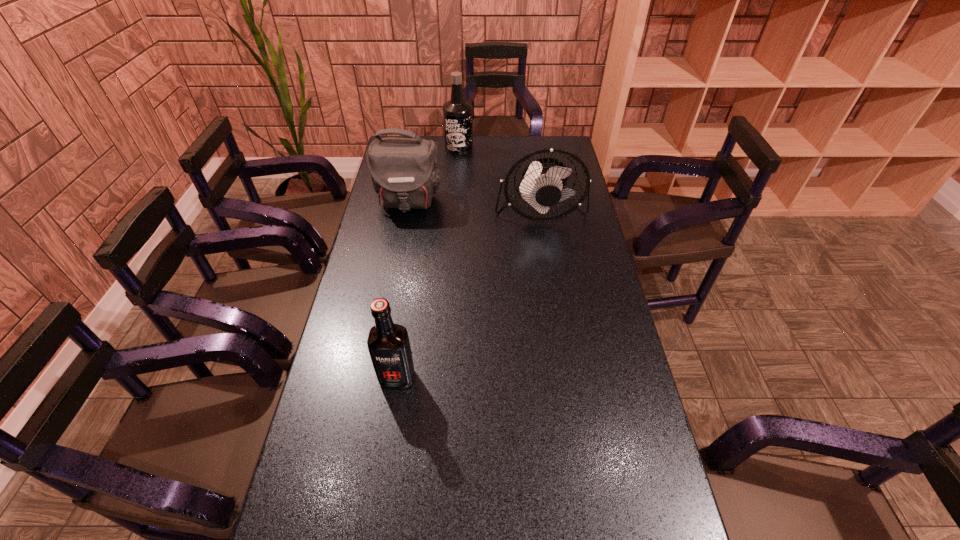
This screenshot has width=960, height=540. I want to click on the farther liquor, so click(x=457, y=113).

Image resolution: width=960 pixels, height=540 pixels. I want to click on the right liquor, so click(x=457, y=113).

Locate an element on the screen. fan is located at coordinates (542, 183).

You are a GUI agent. You are given a task and a screenshot of the screen. Output one action in this format:
    pyautogui.click(x=<x>, y=<y>)
    Task: Click on the nearer liquor
    
    Given the screenshot: What is the action you would take?
    pyautogui.click(x=388, y=344)

The image size is (960, 540). What are the coordinates of `the nearest object` in the screenshot? It's located at (388, 344).

Find the location of `shoulder bag`. shoulder bag is located at coordinates (404, 172).

Identify the location of vacant region located on the front label of the farthest object. Image resolution: width=960 pixels, height=540 pixels. (455, 203).

This screenshot has width=960, height=540. Find the location of `vacant space located 0.150m in front of the rightmost object, directing airflow`. vacant space located 0.150m in front of the rightmost object, directing airflow is located at coordinates (548, 262).

At what (x,y) coordinates should I click in order to perform the action: click on free spot located on the front-facing side of the nearest object. Please return your answer as a coordinate pair (x, y). Image resolution: width=960 pixels, height=540 pixels. Looking at the image, I should click on (381, 488).

Where is `free space located 0.090m on the open flap of the shoulder bag`? The height and width of the screenshot is (540, 960). free space located 0.090m on the open flap of the shoulder bag is located at coordinates (401, 237).